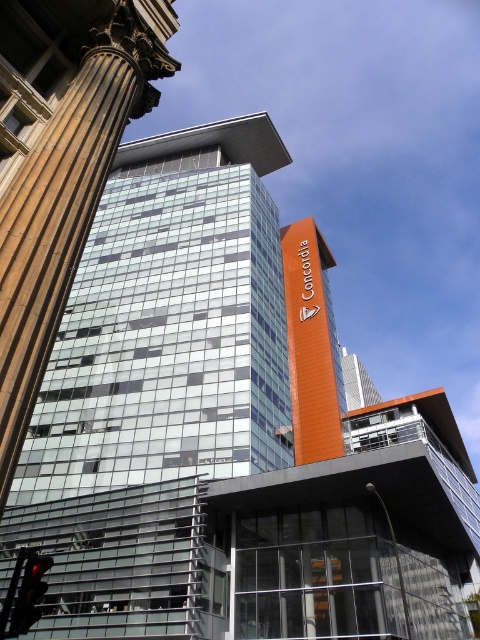
You are a delivery driver approaching the building complex and need to know which object takes up more space between the brown polished stone column at left and the red glass traffic light at lower left. Which one should you mention to the dispatcher?

The red glass traffic light at lower left occupies more space than the brown polished stone column at left, so you should mention the red glass traffic light at lower left to the dispatcher.

You are standing at the base of the main glass building and want to take a photo of the orange vertical structure with the word Concordia. There are two points marked on your map at coordinates point (291,413) and point (41,564). Which point should you stand at to ensure the orange vertical structure is fully visible without any obstruction from the main building?

You should stand at point (41,564) because point (291,413) is behind point (41,564), meaning the main building might obstruct the view from the first point.